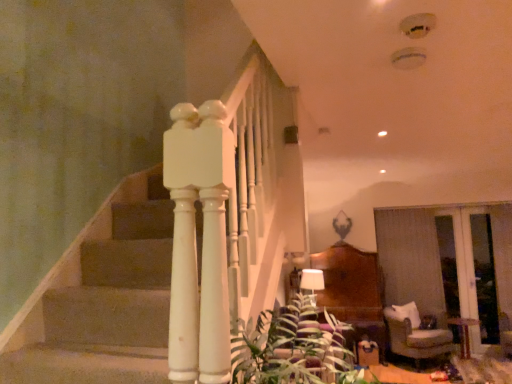
Question: Is white fabric lampshade at center bigger than green leafy plant at lower center?

Choices:
 (A) no
 (B) yes

Answer: (A)

Question: Does white fabric lampshade at center appear on the left side of green leafy plant at lower center?

Choices:
 (A) no
 (B) yes

Answer: (A)

Question: Considering the relative sizes of white fabric lampshade at center and green leafy plant at lower center in the image provided, is white fabric lampshade at center shorter than green leafy plant at lower center?

Choices:
 (A) no
 (B) yes

Answer: (B)

Question: From the image's perspective, is white fabric lampshade at center under green leafy plant at lower center?

Choices:
 (A) yes
 (B) no

Answer: (B)

Question: Is white fabric lampshade at center facing away from green leafy plant at lower center?

Choices:
 (A) no
 (B) yes

Answer: (A)

Question: Considering the positions of wooden glossy table at lower right and white fabric lampshade at center in the image, is wooden glossy table at lower right bigger or smaller than white fabric lampshade at center?

Choices:
 (A) big
 (B) small

Answer: (A)

Question: From the image's perspective, is wooden glossy table at lower right positioned above or below white fabric lampshade at center?

Choices:
 (A) above
 (B) below

Answer: (B)

Question: From a real-world perspective, is wooden glossy table at lower right positioned above or below white fabric lampshade at center?

Choices:
 (A) above
 (B) below

Answer: (B)

Question: Does point (451, 324) appear closer or farther from the camera than point (314, 279)?

Choices:
 (A) farther
 (B) closer

Answer: (A)

Question: Is white fabric lampshade at center wider or thinner than green leafy plant at lower center?

Choices:
 (A) wide
 (B) thin

Answer: (B)

Question: Considering the relative positions of white fabric lampshade at center and green leafy plant at lower center in the image provided, is white fabric lampshade at center to the left or to the right of green leafy plant at lower center?

Choices:
 (A) left
 (B) right

Answer: (B)

Question: From a real-world perspective, is white fabric lampshade at center positioned above or below green leafy plant at lower center?

Choices:
 (A) below
 (B) above

Answer: (B)

Question: Is white fabric lampshade at center taller or shorter than green leafy plant at lower center?

Choices:
 (A) tall
 (B) short

Answer: (B)

Question: Considering the positions of beige fabric armchair at lower right and wooden glossy table at lower right in the image, is beige fabric armchair at lower right bigger or smaller than wooden glossy table at lower right?

Choices:
 (A) big
 (B) small

Answer: (A)

Question: From the image's perspective, is beige fabric armchair at lower right located above or below wooden glossy table at lower right?

Choices:
 (A) below
 (B) above

Answer: (B)